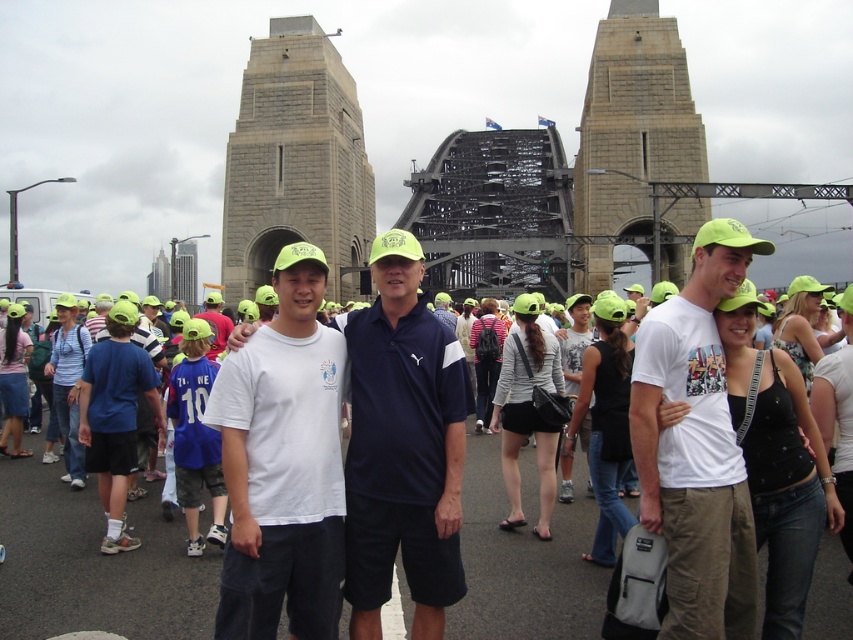
Does white cotton shirt at center have a greater width compared to white cotton t-shirt at center?

Indeed, white cotton shirt at center has a greater width compared to white cotton t-shirt at center.

Does white cotton shirt at center appear over white cotton t-shirt at center?

Actually, white cotton shirt at center is below white cotton t-shirt at center.

You are a GUI agent. You are given a task and a screenshot of the screen. Output one action in this format:
    pyautogui.click(x=<x>, y=<y>)
    Task: Click on the white cotton shirt at center
    The width and height of the screenshot is (853, 640).
    Given the screenshot: What is the action you would take?
    pyautogui.click(x=403, y=448)

Can you confirm if white matte t-shirt at center is wider than white cotton shirt at center?

Incorrect, white matte t-shirt at center's width does not surpass white cotton shirt at center's.

Is white matte t-shirt at center positioned in front of white cotton shirt at center?

Yes, white matte t-shirt at center is closer to the viewer.

What are the coordinates of `white matte t-shirt at center` in the screenshot? It's located at (283, 465).

Locate an element on the screen. The width and height of the screenshot is (853, 640). white matte t-shirt at center is located at coordinates (283, 465).

Between white cotton shirt at center and gray stone tower at center, which one has less height?

With less height is white cotton shirt at center.

Who is more distant from viewer, (387, 403) or (242, 195)?

Positioned behind is point (242, 195).

Where is `white cotton shirt at center`? white cotton shirt at center is located at coordinates (403, 448).

Locate an element on the screen. white cotton shirt at center is located at coordinates (403, 448).